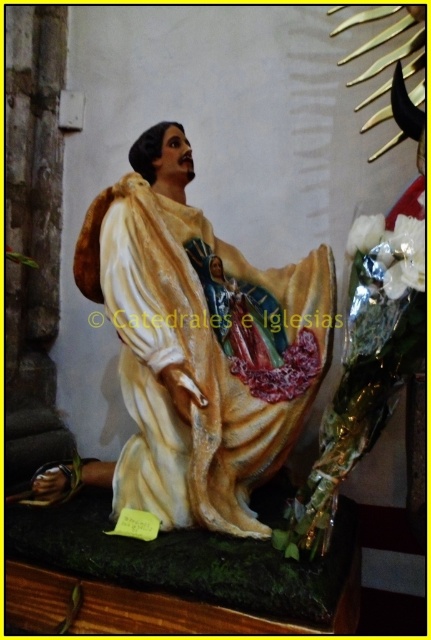
Is white glossy robe at center above white metallic flowers at center right?

No, white glossy robe at center is not above white metallic flowers at center right.

Between white glossy robe at center and white metallic flowers at center right, which one appears on the right side from the viewer's perspective?

white metallic flowers at center right

What do you see at coordinates (202, 355) in the screenshot? The image size is (431, 640). I see `white glossy robe at center` at bounding box center [202, 355].

Find the location of a particular element. The width and height of the screenshot is (431, 640). white glossy robe at center is located at coordinates (202, 355).

Can you confirm if white glossy robe at center is taller than white matte flower at center?

Indeed, white glossy robe at center has a greater height compared to white matte flower at center.

At what (x,y) coordinates should I click in order to perform the action: click on white glossy robe at center. Please return your answer as a coordinate pair (x, y). Image resolution: width=431 pixels, height=640 pixels. Looking at the image, I should click on (202, 355).

The height and width of the screenshot is (640, 431). In order to click on white glossy robe at center in this screenshot , I will do pyautogui.click(x=202, y=355).

Find the location of a particular element. The image size is (431, 640). white metallic flowers at center right is located at coordinates (392, 250).

Does white metallic flowers at center right appear under white matte flower at center?

Indeed, white metallic flowers at center right is positioned under white matte flower at center.

Find the location of `white metallic flowers at center right`. white metallic flowers at center right is located at coordinates (392, 250).

Find the location of `white metallic flowers at center right`. white metallic flowers at center right is located at coordinates (392, 250).